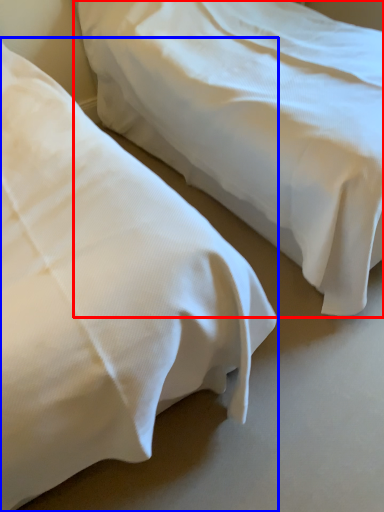
Question: Which object is further to the camera taking this photo, bed (highlighted by a red box) or bed (highlighted by a blue box)?

Choices:
 (A) bed
 (B) bed

Answer: (A)